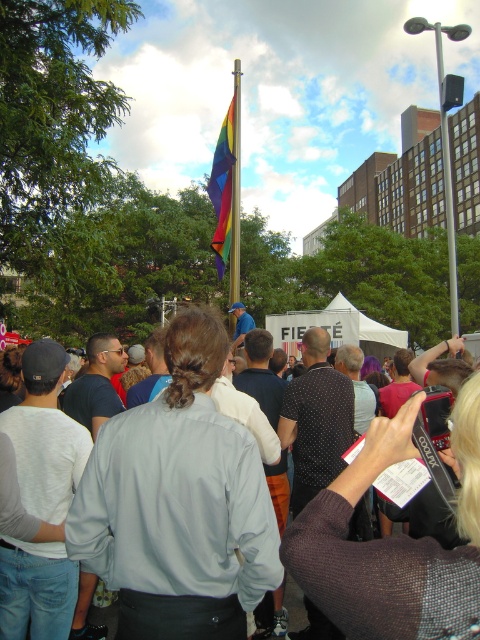
Is the position of rainbow fabric flag at center more distant than that of metallic rainbow flag pole at center?

→ Yes, it is behind metallic rainbow flag pole at center.

Which is in front, point (218, 141) or point (237, 88)?

Point (237, 88) is more forward.

Who is more forward, (215,240) or (236,188)?

Point (215,240) is in front.

The width and height of the screenshot is (480, 640). Find the location of `rainbow fabric flag at center`. rainbow fabric flag at center is located at coordinates (225, 180).

Is gray fabric crowd at center behind metallic rainbow flag pole at center?

No.

Which is more to the left, gray fabric crowd at center or metallic rainbow flag pole at center?

gray fabric crowd at center is more to the left.

Where is `gray fabric crowd at center`? gray fabric crowd at center is located at coordinates (393, 541).

Between metallic flag pole at upper center and metallic rainbow flag pole at center, which one is positioned higher?

metallic flag pole at upper center is above.

Does metallic flag pole at upper center have a lesser width compared to metallic rainbow flag pole at center?

No.

Locate an element on the screen. This screenshot has height=640, width=480. metallic flag pole at upper center is located at coordinates (447, 188).

Find the location of a particular element. The image size is (480, 640). metallic flag pole at upper center is located at coordinates (447, 188).